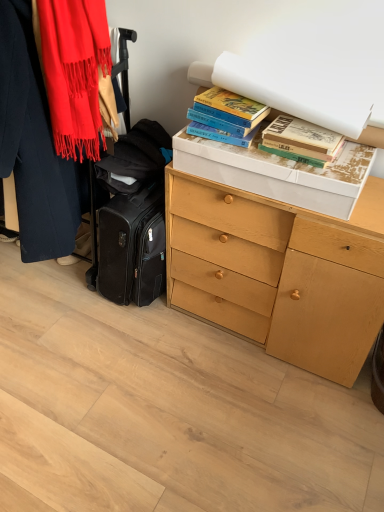
What is the approximate width of light wood chest of drawers at center?

It is 15.15 inches.

Locate an element on the screen. The height and width of the screenshot is (512, 384). light wood chest of drawers at center is located at coordinates (278, 273).

Describe the element at coordinates (230, 106) in the screenshot. I see `hardcover books at upper right, the 2th book in the right-to-left sequence` at that location.

I want to click on light wood chest of drawers at center, so (278, 273).

From a real-world perspective, is hardcover books at upper right, arranged as the 1th book when viewed from the left, above or below matte red scarf at left?

Clearly, from a real-world perspective, hardcover books at upper right, arranged as the 1th book when viewed from the left, is below matte red scarf at left.

Which point is more forward, (x=224, y=117) or (x=93, y=63)?

Point (x=93, y=63)

From the image's perspective, is hardcover books at upper right, the 2th book in the right-to-left sequence, located above or below matte red scarf at left?

Based on their image positions, hardcover books at upper right, the 2th book in the right-to-left sequence, is located beneath matte red scarf at left.

Does hardcover books at upper right, the 2th book in the right-to-left sequence, have a greater height compared to matte red scarf at left?

Incorrect, the height of hardcover books at upper right, the 2th book in the right-to-left sequence, is not larger of that of matte red scarf at left.

Does light wood chest of drawers at center contain hardcover books at upper right, the second book when ordered from left to right?

No, hardcover books at upper right, the second book when ordered from left to right, is not surrounded by light wood chest of drawers at center.

Is light wood chest of drawers at center to the right of hardcover books at upper right, the first book viewed from the right, from the viewer's perspective?

No, light wood chest of drawers at center is not to the right of hardcover books at upper right, the first book viewed from the right.

Is light wood chest of drawers at center closer to camera compared to hardcover books at upper right, the second book when ordered from left to right?

Yes.

Is matte red scarf at left facing away from hardcover books at upper right, the first book viewed from the right?

matte red scarf at left is not turned away from hardcover books at upper right, the first book viewed from the right.

Are matte red scarf at left and hardcover books at upper right, the first book viewed from the right, making contact?

matte red scarf at left and hardcover books at upper right, the first book viewed from the right, are clearly separated.

Based on the photo, would you say matte red scarf at left is to the left or to the right of hardcover books at upper right, the second book when ordered from left to right, in the picture?

In the image, matte red scarf at left appears on the left side of hardcover books at upper right, the second book when ordered from left to right.

From a real-world perspective, is hardcover books at upper right, the 2th book in the right-to-left sequence, located higher than light wood chest of drawers at center?

Yes, from a real-world perspective, hardcover books at upper right, the 2th book in the right-to-left sequence, is on top of light wood chest of drawers at center.

Which is correct: hardcover books at upper right, the 2th book in the right-to-left sequence, is inside light wood chest of drawers at center, or outside of it?

hardcover books at upper right, the 2th book in the right-to-left sequence, lies outside light wood chest of drawers at center.

Is hardcover books at upper right, the 2th book in the right-to-left sequence, positioned with its back to light wood chest of drawers at center?

No, hardcover books at upper right, the 2th book in the right-to-left sequence, is not facing away from light wood chest of drawers at center.

Considering the sizes of objects hardcover books at upper right, the 2th book in the right-to-left sequence, and light wood chest of drawers at center in the image provided, who is smaller, hardcover books at upper right, the 2th book in the right-to-left sequence, or light wood chest of drawers at center?

With smaller size is hardcover books at upper right, the 2th book in the right-to-left sequence.

Is light wood chest of drawers at center aimed at hardcover books at upper right, arranged as the 1th book when viewed from the left?

No.

Is light wood chest of drawers at center in front of or behind hardcover books at upper right, arranged as the 1th book when viewed from the left, in the image?

light wood chest of drawers at center is in front of hardcover books at upper right, arranged as the 1th book when viewed from the left.

You are a GUI agent. You are given a task and a screenshot of the screen. Output one action in this format:
    pyautogui.click(x=<x>, y=<y>)
    Task: Click on the book on the left of light wood chest of drawers at center
    
    Given the screenshot: What is the action you would take?
    pyautogui.click(x=230, y=106)

Would you say light wood chest of drawers at center is to the left or to the right of hardcover books at upper right, arranged as the 1th book when viewed from the left, in the picture?

In the image, light wood chest of drawers at center appears on the right side of hardcover books at upper right, arranged as the 1th book when viewed from the left.

How much distance is there between hardcover books at upper right, the first book viewed from the right, and hardcover books at upper right, the 2th book in the right-to-left sequence?

hardcover books at upper right, the first book viewed from the right, is 5.57 inches from hardcover books at upper right, the 2th book in the right-to-left sequence.

Is the position of hardcover books at upper right, the first book viewed from the right, less distant than that of hardcover books at upper right, arranged as the 1th book when viewed from the left?

Yes, the depth of hardcover books at upper right, the first book viewed from the right, is less than that of hardcover books at upper right, arranged as the 1th book when viewed from the left.

Is point (319, 155) positioned behind point (228, 106)?

No.

In the scene shown: Is hardcover books at upper right, arranged as the 1th book when viewed from the left, located within hardcover books at upper right, the first book viewed from the right?

Actually, hardcover books at upper right, arranged as the 1th book when viewed from the left, is outside hardcover books at upper right, the first book viewed from the right.

Is matte red scarf at left with hardcover books at upper right, the 2th book in the right-to-left sequence?

No.

Considering the positions of objects matte red scarf at left and hardcover books at upper right, arranged as the 1th book when viewed from the left, in the image provided, who is behind, matte red scarf at left or hardcover books at upper right, arranged as the 1th book when viewed from the left,?

hardcover books at upper right, arranged as the 1th book when viewed from the left, is behind.

Considering the relative positions of matte red scarf at left and hardcover books at upper right, arranged as the 1th book when viewed from the left, in the image provided, is matte red scarf at left to the left of hardcover books at upper right, arranged as the 1th book when viewed from the left, from the viewer's perspective?

Indeed, matte red scarf at left is positioned on the left side of hardcover books at upper right, arranged as the 1th book when viewed from the left.

The image size is (384, 512). Identify the location of scarf in front of the hardcover books at upper right, arranged as the 1th book when viewed from the left. (77, 74).

At what (x,y) coordinates should I click in order to perform the action: click on the chest of drawers located underneath the hardcover books at upper right, the first book viewed from the right (from a real-world perspective). Please return your answer as a coordinate pair (x, y). The height and width of the screenshot is (512, 384). Looking at the image, I should click on (278, 273).

In the scene shown: Considering their positions, is hardcover books at upper right, the second book when ordered from left to right, positioned closer to hardcover books at upper right, the 2th book in the right-to-left sequence, than matte red scarf at left?

hardcover books at upper right, the second book when ordered from left to right.

When comparing their distances from light wood chest of drawers at center, does matte red scarf at left or hardcover books at upper right, the second book when ordered from left to right, seem further?

matte red scarf at left.

Consider the image. From the image, which object appears to be nearer to matte red scarf at left, hardcover books at upper right, the 2th book in the right-to-left sequence, or hardcover books at upper right, the first book viewed from the right?

hardcover books at upper right, the 2th book in the right-to-left sequence.

Looking at the image, which one is located further to hardcover books at upper right, the second book when ordered from left to right, hardcover books at upper right, arranged as the 1th book when viewed from the left, or light wood chest of drawers at center?

light wood chest of drawers at center lies further to hardcover books at upper right, the second book when ordered from left to right, than the other object.

Considering their positions, is hardcover books at upper right, the second book when ordered from left to right, positioned closer to hardcover books at upper right, the 2th book in the right-to-left sequence, than light wood chest of drawers at center?

hardcover books at upper right, the second book when ordered from left to right.

Which object lies further to the anchor point light wood chest of drawers at center, hardcover books at upper right, arranged as the 1th book when viewed from the left, or hardcover books at upper right, the second book when ordered from left to right?

The object further to light wood chest of drawers at center is hardcover books at upper right, arranged as the 1th book when viewed from the left.

Which object lies nearer to the anchor point hardcover books at upper right, the second book when ordered from left to right, matte red scarf at left or hardcover books at upper right, arranged as the 1th book when viewed from the left?

hardcover books at upper right, arranged as the 1th book when viewed from the left, lies closer to hardcover books at upper right, the second book when ordered from left to right, than the other object.

Looking at this image, estimate the real-world distances between objects in this image. Which object is closer to light wood chest of drawers at center, hardcover books at upper right, the first book viewed from the right, or hardcover books at upper right, the 2th book in the right-to-left sequence?

Based on the image, hardcover books at upper right, the first book viewed from the right, appears to be nearer to light wood chest of drawers at center.

The height and width of the screenshot is (512, 384). I want to click on book between hardcover books at upper right, the 2th book in the right-to-left sequence, and light wood chest of drawers at center in the up-down direction, so click(x=301, y=139).

Locate an element on the screen. This screenshot has height=512, width=384. book between matte red scarf at left and hardcover books at upper right, the first book viewed from the right is located at coordinates (230, 106).

I want to click on chest of drawers between matte red scarf at left and hardcover books at upper right, the first book viewed from the right, so click(x=278, y=273).

In order to click on book between matte red scarf at left and light wood chest of drawers at center from left to right in this screenshot , I will do `click(230, 106)`.